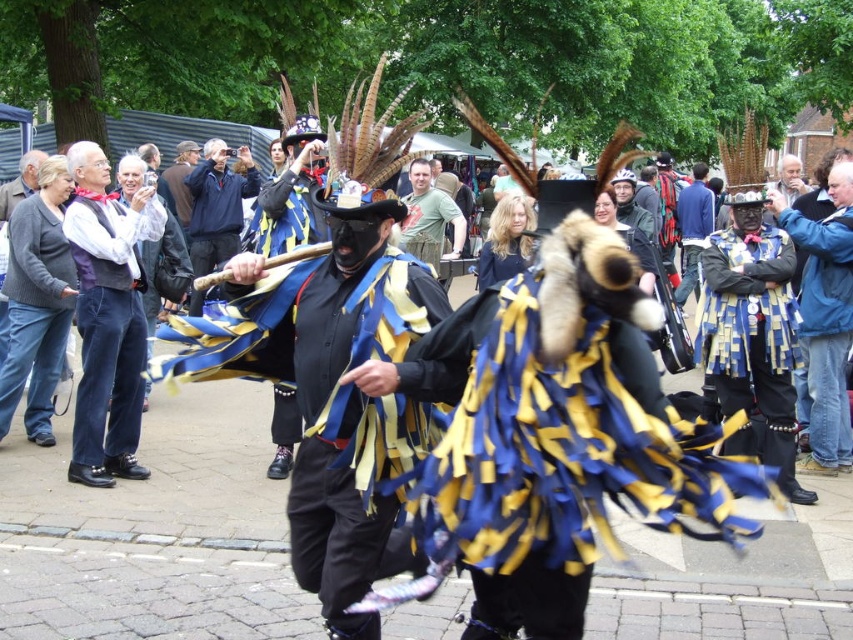
Between point (90, 451) and point (776, 195), which one is positioned behind?

The point (776, 195) is behind.

Who is taller, matte black vest at left or blue and yellow fabric mask at center?

Standing taller between the two is blue and yellow fabric mask at center.

What do you see at coordinates (109, 324) in the screenshot? The width and height of the screenshot is (853, 640). I see `matte black vest at left` at bounding box center [109, 324].

Find the location of a particular element. This screenshot has height=640, width=853. matte black vest at left is located at coordinates (109, 324).

Is point (659, 412) positioned behind point (196, 212)?

No, it is in front of (196, 212).

Does blue and yellow fabric at center appear over blue fabric mask at center?

Incorrect, blue and yellow fabric at center is not positioned above blue fabric mask at center.

Between point (476, 534) and point (206, 188), which one is positioned in front?

Point (476, 534)

I want to click on blue and yellow fabric at center, so click(x=556, y=428).

Is point (792, 216) closer to viewer compared to point (235, 182)?

Yes, it is.

Can you confirm if blue and yellow fabric mask at center is shorter than blue fabric mask at center?

No.

Based on the photo, who is more distant from viewer, (848, 262) or (213, 243)?

Point (213, 243)

In order to click on blue and yellow fabric mask at center in this screenshot , I will do `click(825, 317)`.